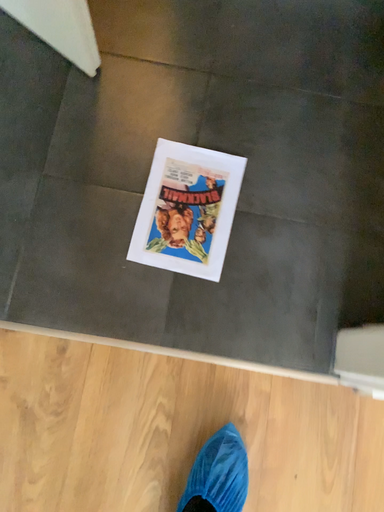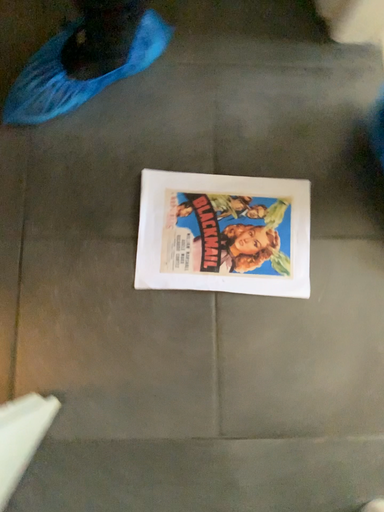
Question: How did the camera likely rotate when shooting the video?

Choices:
 (A) rotated downward
 (B) rotated upward

Answer: (B)